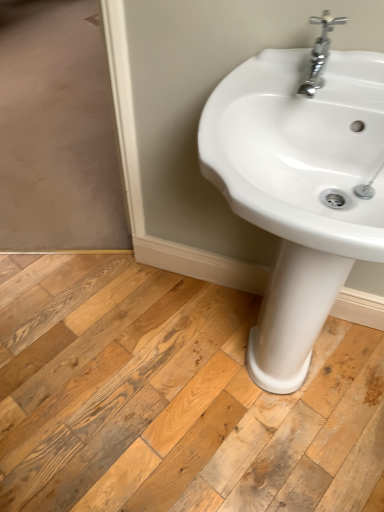
You are a GUI agent. You are given a task and a screenshot of the screen. Output one action in this format:
    pyautogui.click(x=<x>, y=<y>)
    Task: Click on the free point to the left of white glossy sink at center
    The width and height of the screenshot is (384, 512).
    Given the screenshot: What is the action you would take?
    pyautogui.click(x=131, y=361)